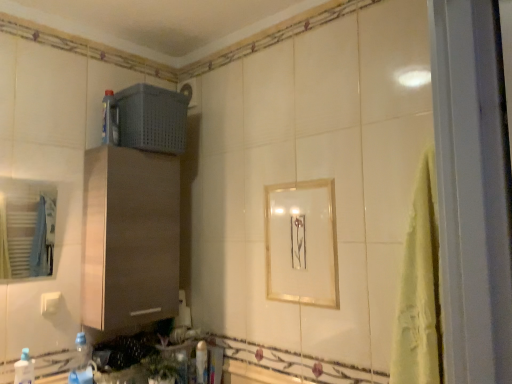
Question: Does white glossy bath at lower center lie behind gray plastic basket at upper center?

Choices:
 (A) no
 (B) yes

Answer: (A)

Question: Considering the relative sizes of white glossy bath at lower center and gray plastic basket at upper center in the image provided, is white glossy bath at lower center wider than gray plastic basket at upper center?

Choices:
 (A) yes
 (B) no

Answer: (B)

Question: Is white glossy bath at lower center to the right of gray plastic basket at upper center from the viewer's perspective?

Choices:
 (A) no
 (B) yes

Answer: (B)

Question: Is white glossy bath at lower center facing towards gray plastic basket at upper center?

Choices:
 (A) yes
 (B) no

Answer: (B)

Question: Is white glossy bath at lower center far from gray plastic basket at upper center?

Choices:
 (A) yes
 (B) no

Answer: (A)

Question: Is point (19, 357) closer or farther from the camera than point (170, 226)?

Choices:
 (A) farther
 (B) closer

Answer: (B)

Question: Would you say translucent plastic bottle at lower left, the fourth bottle from the back, is inside or outside brushed wood cabinet at center?

Choices:
 (A) inside
 (B) outside

Answer: (B)

Question: Considering their positions, is translucent plastic bottle at lower left, the first bottle positioned from the front, located in front of or behind brushed wood cabinet at center?

Choices:
 (A) front
 (B) behind

Answer: (A)

Question: From the image's perspective, is translucent plastic bottle at lower left, the fourth bottle from the back, above or below brushed wood cabinet at center?

Choices:
 (A) below
 (B) above

Answer: (A)

Question: From a real-world perspective, is blue plastic bottle at lower left, the 3th bottle in the top-to-bottom sequence, above or below translucent plastic bottle at upper left, acting as the fourth bottle starting from the bottom?

Choices:
 (A) above
 (B) below

Answer: (B)

Question: Relative to translucent plastic bottle at upper left, placed as the 2th bottle when sorted from right to left, is blue plastic bottle at lower left, the 2th bottle in the bottom-to-top sequence, in front or behind?

Choices:
 (A) behind
 (B) front

Answer: (B)

Question: From the image's perspective, relative to translucent plastic bottle at upper left, placed as the 2th bottle when sorted from right to left, is blue plastic bottle at lower left, placed as the 2th bottle when sorted from front to back, above or below?

Choices:
 (A) below
 (B) above

Answer: (A)

Question: In the image, is blue plastic bottle at lower left, which appears as the third bottle when viewed from the back, on the left side or the right side of translucent plastic bottle at upper left, arranged as the third bottle when viewed from the left?

Choices:
 (A) right
 (B) left

Answer: (B)

Question: In terms of height, does translucent plastic bottle at upper left, placed as the 2th bottle when sorted from right to left, look taller or shorter compared to white glossy bottle at lower center, acting as the fourth bottle starting from the front?

Choices:
 (A) short
 (B) tall

Answer: (B)

Question: Looking at their shapes, would you say translucent plastic bottle at upper left, placed as the 2th bottle when sorted from right to left, is wider or thinner than white glossy bottle at lower center, positioned as the first bottle in right-to-left order?

Choices:
 (A) wide
 (B) thin

Answer: (A)